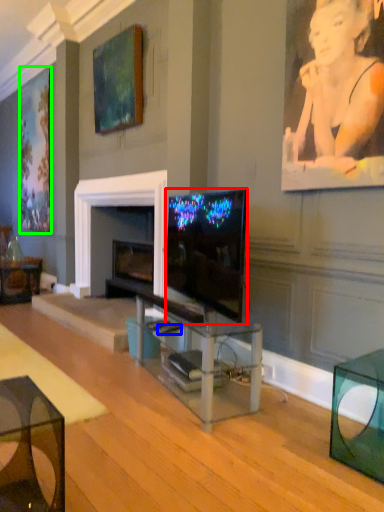
Question: Which is nearer to the television (highlighted by a red box)? remote control (highlighted by a blue box) or picture frame (highlighted by a green box).

Choices:
 (A) remote control
 (B) picture frame

Answer: (A)